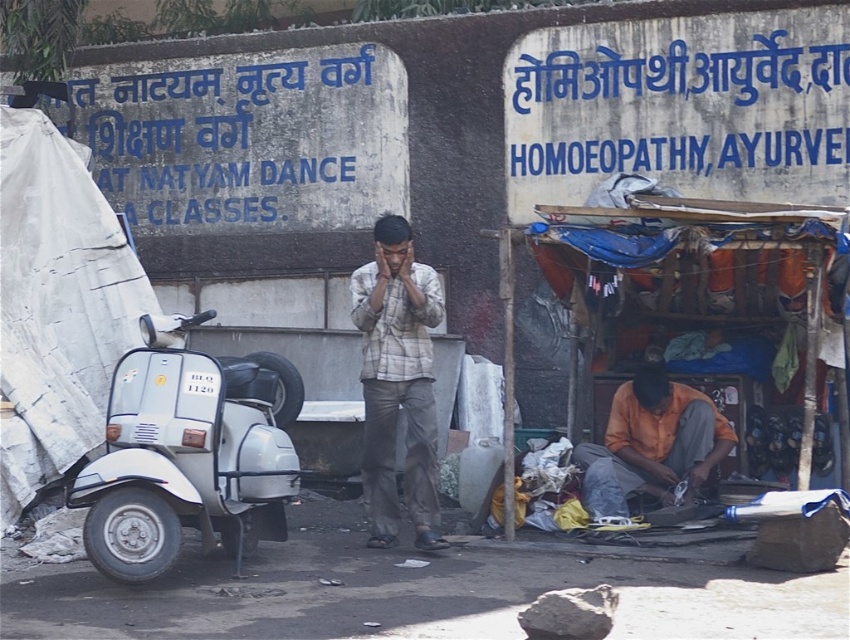
Question: Is white matte scooter at left below plaid fabric shirt at center?

Choices:
 (A) yes
 (B) no

Answer: (A)

Question: Among these points, which one is farthest from the camera?

Choices:
 (A) (383, 484)
 (B) (278, 529)

Answer: (A)

Question: Where is white matte scooter at left located in relation to plaid fabric shirt at center in the image?

Choices:
 (A) below
 (B) above

Answer: (A)

Question: Is white matte scooter at left to the left of orange fabric at lower center from the viewer's perspective?

Choices:
 (A) no
 (B) yes

Answer: (B)

Question: Which point is closer to the camera taking this photo?

Choices:
 (A) (724, 422)
 (B) (292, 490)
 (C) (383, 497)

Answer: (B)

Question: Which of these objects is positioned farthest from the orange fabric at lower center?

Choices:
 (A) plaid fabric shirt at center
 (B) white matte scooter at left

Answer: (B)